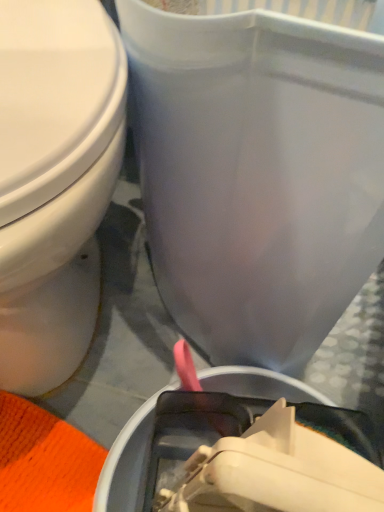
What are the coordinates of `matte plastic trash can at center` in the screenshot? It's located at (257, 174).

In order to face matte plastic trash can at center, should I rotate leftwards or rightwards?

Rotate your view right by about 5.925°.

Describe the element at coordinates (257, 174) in the screenshot. I see `matte plastic trash can at center` at that location.

Where is `matte plastic trash can at center`? matte plastic trash can at center is located at coordinates (257, 174).